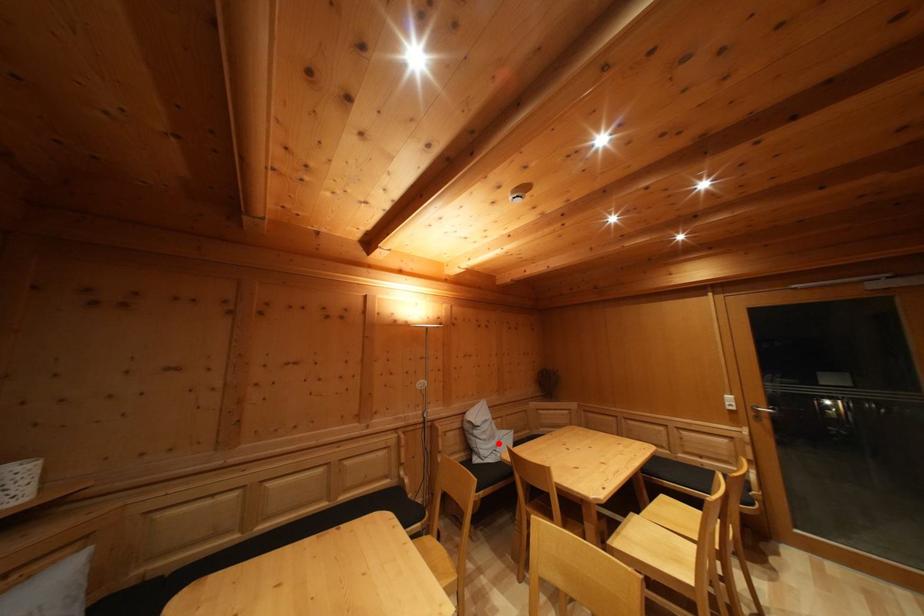
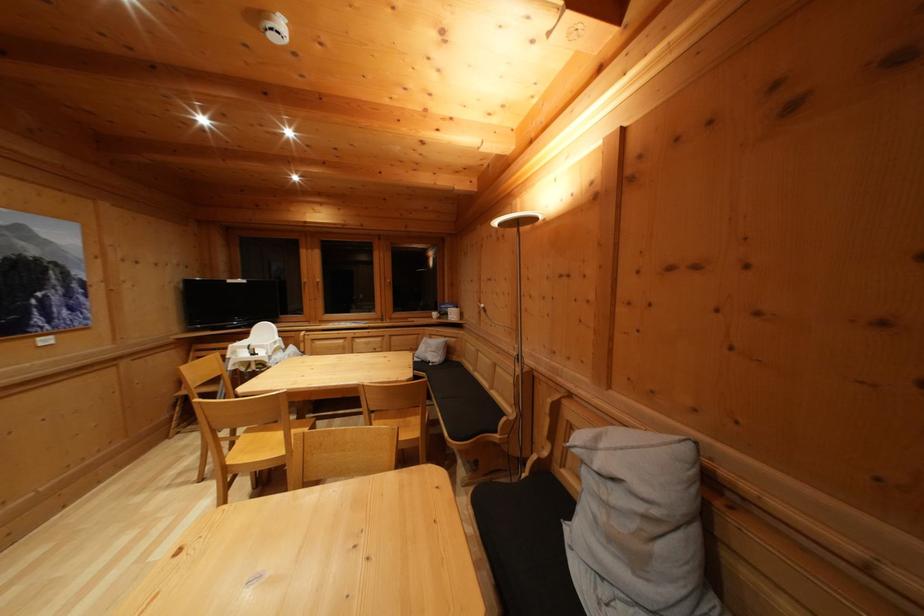
Where in the second image is the point corresponding to the highlighted location from the first image?

(640, 565)